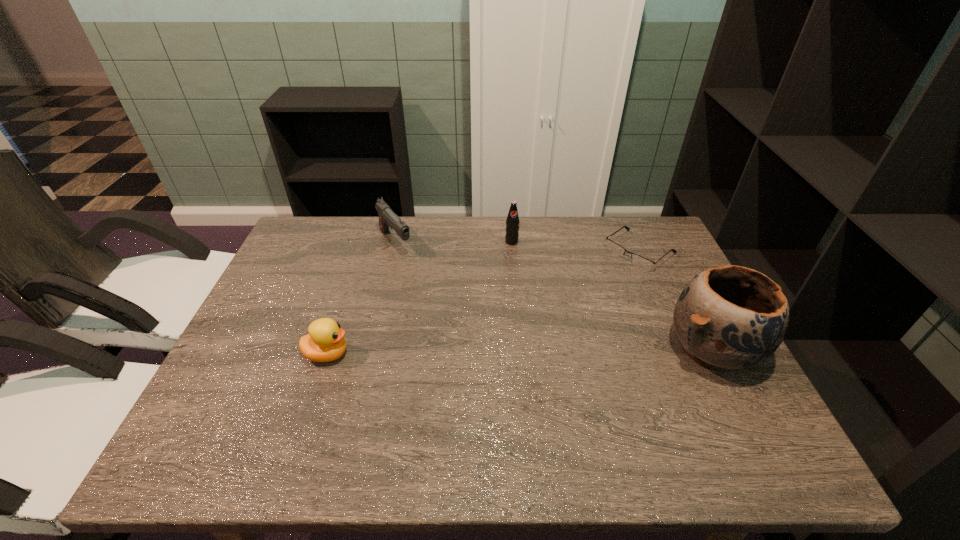
Find the location of a particular element. The width and height of the screenshot is (960, 540). pottery that is at the right edge is located at coordinates (728, 317).

This screenshot has height=540, width=960. I want to click on spectacles located at the right edge, so click(639, 261).

Locate an element on the screen. The height and width of the screenshot is (540, 960). object at the far right corner is located at coordinates (639, 261).

You are a GUI agent. You are given a task and a screenshot of the screen. Output one action in this format:
    pyautogui.click(x=<x>, y=<y>)
    Task: Click on the object that is at the near right corner
    The image size is (960, 540).
    Given the screenshot: What is the action you would take?
    (x=728, y=317)

You are a GUI agent. You are given a task and a screenshot of the screen. Output one action in this format:
    pyautogui.click(x=<x>, y=<y>)
    Task: Click on the free space at the far edge of the desktop
    The image size is (960, 540).
    Given the screenshot: What is the action you would take?
    pyautogui.click(x=503, y=240)

This screenshot has width=960, height=540. I want to click on free region at the near edge of the desktop, so click(420, 394).

In the image, there is a desktop. Where is `vacant space at the left edge`? This screenshot has height=540, width=960. vacant space at the left edge is located at coordinates (312, 276).

Locate an element on the screen. This screenshot has width=960, height=540. vacant space at the right edge of the desktop is located at coordinates (644, 271).

Locate an element on the screen. free space at the far left corner is located at coordinates (329, 227).

Where is `vacant space at the far right corner of the desktop`? The image size is (960, 540). vacant space at the far right corner of the desktop is located at coordinates (648, 233).